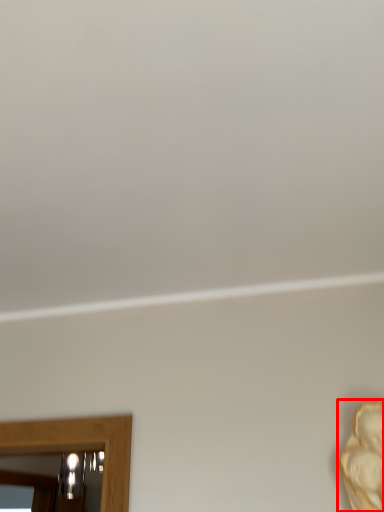
Question: From the image, what is the correct spatial relationship of person (annotated by the red box) in relation to mirror?

Choices:
 (A) left
 (B) right

Answer: (B)